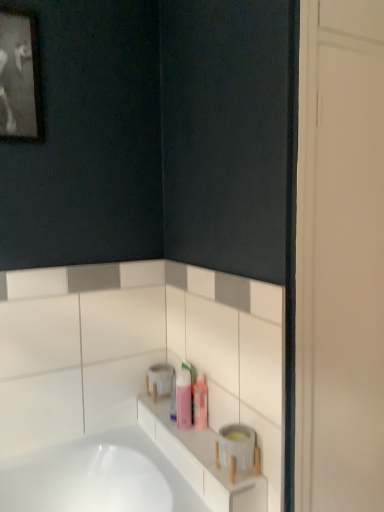
What are the coordinates of `blank space situated above translucent plastic containers at lower center (from a real-world perspective)` in the screenshot? It's located at (192, 431).